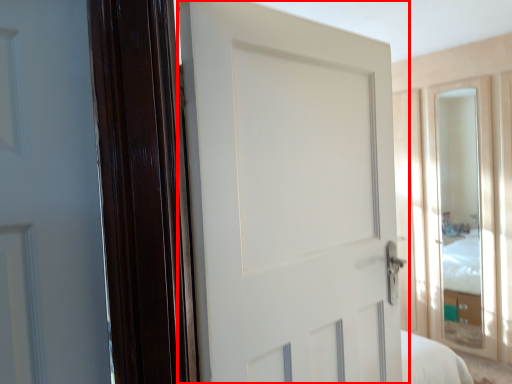
Question: From the image, what is the correct spatial relationship of door (annotated by the red box) in relation to glass door?

Choices:
 (A) right
 (B) left

Answer: (B)